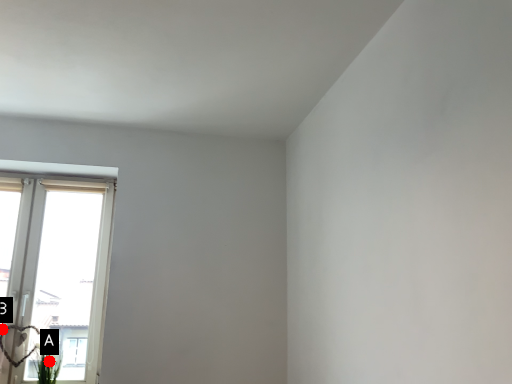
Question: Two points are circled on the image, labeled by A and B beside each circle. Which point is closer to the camera?

Choices:
 (A) A is closer
 (B) B is closer

Answer: (A)